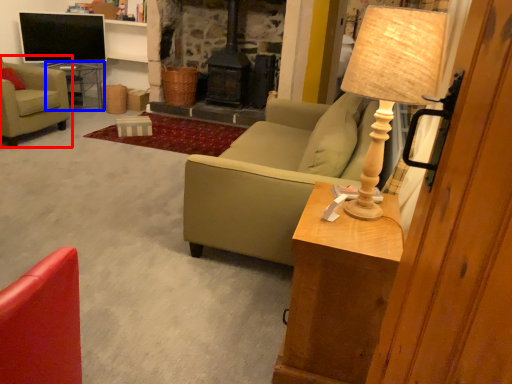
Question: Which object is closer to the camera taking this photo, chair (highlighted by a red box) or table (highlighted by a blue box)?

Choices:
 (A) chair
 (B) table

Answer: (A)